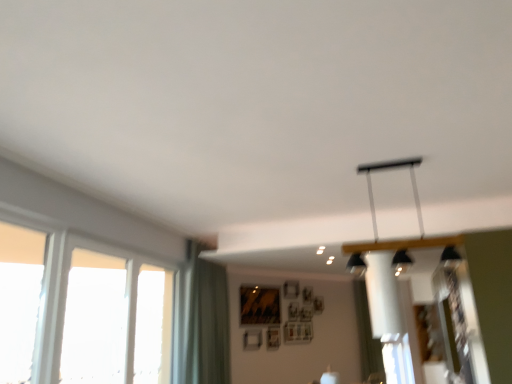
Question: Looking at the image, does green fabric curtain at lower left, the second curtain from the back, seem bigger or smaller compared to clear glass window at left, the 3th window viewed from the left?

Choices:
 (A) small
 (B) big

Answer: (B)

Question: In terms of width, does green fabric curtain at lower left, the second curtain from the back, look wider or thinner when compared to clear glass window at left, placed as the first window when sorted from right to left?

Choices:
 (A) thin
 (B) wide

Answer: (B)

Question: Estimate the real-world distances between objects in this image. Which object is farther from the white fabric curtain at center, the 1th curtain from the right?

Choices:
 (A) white plastic window at left, the third window from the right
 (B) green fabric curtain at lower left, the first curtain viewed from the front
 (C) transparent glass window at left, which is counted as the 2th window, starting from the left
 (D) clear glass window at left, the 3th window viewed from the left

Answer: (A)

Question: Which object is positioned farthest from the transparent glass window at left, which is counted as the 2th window, starting from the left?

Choices:
 (A) green fabric curtain at lower left, the second curtain from the back
 (B) clear glass window at left, the 3th window viewed from the left
 (C) white plastic window at left, the third window from the right
 (D) white fabric curtain at center, the 1th curtain from the back

Answer: (D)